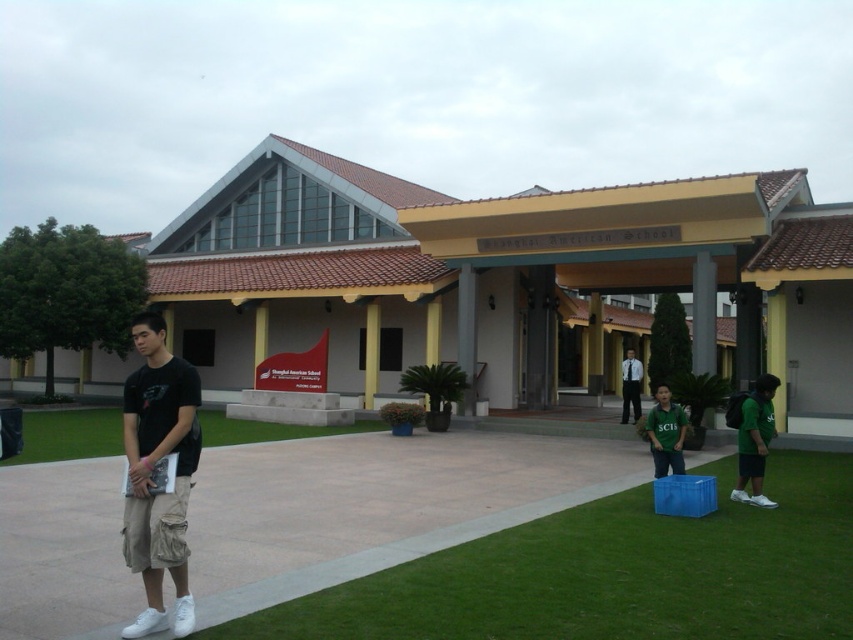
Question: Is green grass at lower right smaller than green grass at lower left?

Choices:
 (A) yes
 (B) no

Answer: (A)

Question: Which object is positioned farthest from the green grass at lower right?

Choices:
 (A) white shirt at center
 (B) green matte shirt at lower right
 (C) matte black t-shirt at left

Answer: (A)

Question: Which point is farther to the camera?

Choices:
 (A) coord(364,637)
 (B) coord(164,413)
 (C) coord(675,454)
 (D) coord(757,438)

Answer: (C)

Question: Which point is closer to the camera?

Choices:
 (A) green grass at lower right
 (B) white shirt at center
 (C) green matte shirt at center

Answer: (A)

Question: From the image, what is the correct spatial relationship of green grass at lower right in relation to matte black t-shirt at left?

Choices:
 (A) left
 (B) right

Answer: (B)

Question: Does matte black t-shirt at left appear on the right side of green matte shirt at lower right?

Choices:
 (A) yes
 (B) no

Answer: (B)